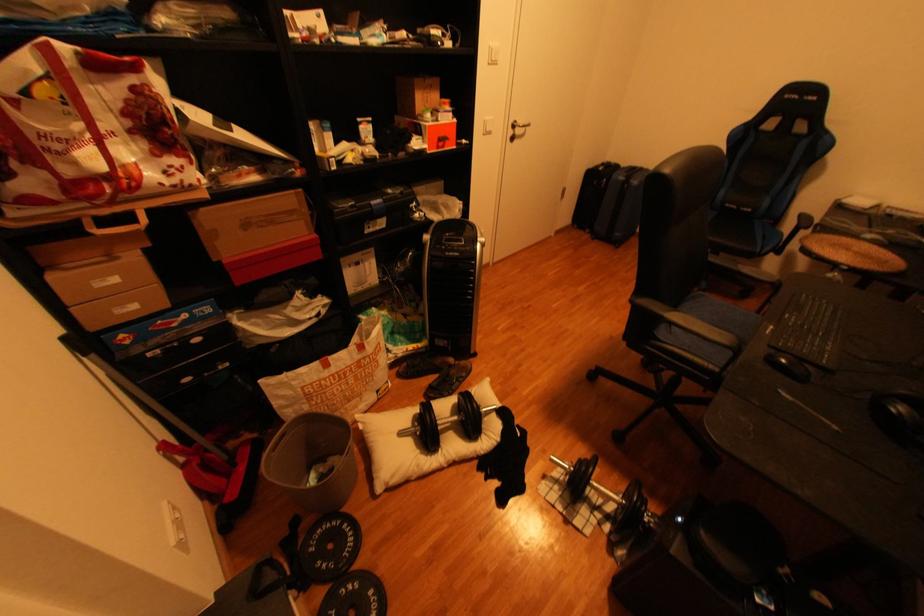
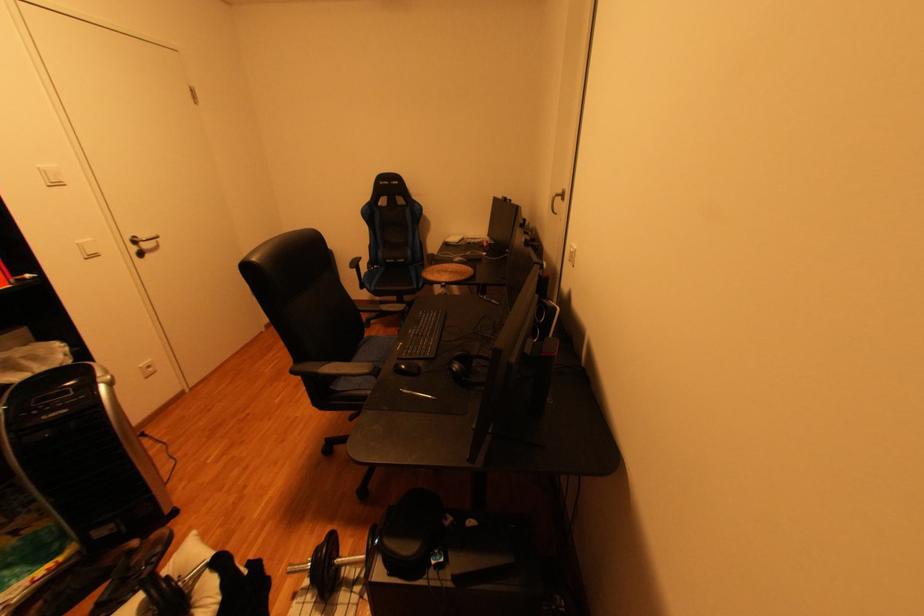
Locate, in the second image, the point that corresponds to the point at 494,118 in the first image.

(89, 243)